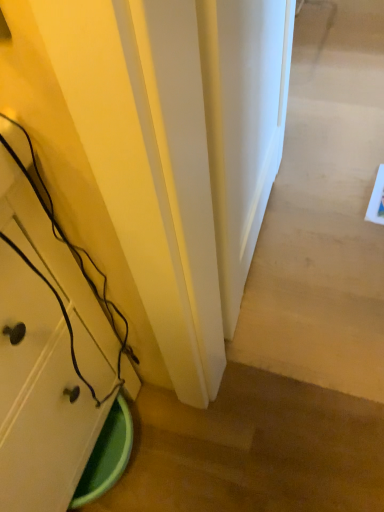
This screenshot has height=512, width=384. What do you see at coordinates (39, 397) in the screenshot?
I see `matte white cabinet at lower left` at bounding box center [39, 397].

This screenshot has height=512, width=384. In order to click on matte white cabinet at lower left in this screenshot , I will do `click(39, 397)`.

In order to face matte white cabinet at lower left, should I rotate leftwards or rightwards?

To align with it, rotate left about 28.756°.

Consider the image. Measure the distance between white smooth door at center and camera.

The depth of white smooth door at center is 51.93 centimeters.

This screenshot has width=384, height=512. Identify the location of white smooth door at center. (243, 124).

This screenshot has width=384, height=512. What do you see at coordinates (243, 124) in the screenshot? I see `white smooth door at center` at bounding box center [243, 124].

Find the location of `matte white cabinet at lower left`. matte white cabinet at lower left is located at coordinates (39, 397).

Is white smooth door at center to the left or to the right of matte white cabinet at lower left in the image?

white smooth door at center is to the right of matte white cabinet at lower left.

Does white smooth door at center lie behind matte white cabinet at lower left?

Yes, the depth of white smooth door at center is greater than that of matte white cabinet at lower left.

Which is closer to the camera, (206, 91) or (53, 281)?

Positioned in front is point (206, 91).

From the image's perspective, is white smooth door at center beneath matte white cabinet at lower left?

No.

From a real-world perspective, between white smooth door at center and matte white cabinet at lower left, who is vertically lower?

matte white cabinet at lower left.

In terms of width, does white smooth door at center look wider or thinner when compared to matte white cabinet at lower left?

white smooth door at center is thinner than matte white cabinet at lower left.

Looking at this image, in terms of height, does white smooth door at center look taller or shorter compared to matte white cabinet at lower left?

Clearly, white smooth door at center is taller compared to matte white cabinet at lower left.

Which of these two, white smooth door at center or matte white cabinet at lower left, is bigger?

With larger size is matte white cabinet at lower left.

Could matte white cabinet at lower left be considered to be inside white smooth door at center?

No, matte white cabinet at lower left is not surrounded by white smooth door at center.

Are white smooth door at center and matte white cabinet at lower left located far from each other?

No, white smooth door at center is not far away from matte white cabinet at lower left.

Based on the photo, is white smooth door at center oriented away from matte white cabinet at lower left?

No, white smooth door at center is not facing away from matte white cabinet at lower left.

How different are the orientations of white smooth door at center and matte white cabinet at lower left in degrees?

white smooth door at center and matte white cabinet at lower left are facing 2.95 degrees away from each other.

At what (x,y) coordinates should I click in order to perform the action: click on cabinetry in front of the white smooth door at center. Please return your answer as a coordinate pair (x, y). This screenshot has height=512, width=384. Looking at the image, I should click on (39, 397).

Can you confirm if matte white cabinet at lower left is positioned to the left of white smooth door at center?

Correct, you'll find matte white cabinet at lower left to the left of white smooth door at center.

Between matte white cabinet at lower left and white smooth door at center, which one is positioned in front?

matte white cabinet at lower left is more forward.

Which is in front, point (91, 362) or point (276, 99)?

Point (91, 362)

From the image's perspective, does matte white cabinet at lower left appear higher than white smooth door at center?

Incorrect, from the image's perspective, matte white cabinet at lower left is lower than white smooth door at center.

From a real-world perspective, which object rests below the other?

matte white cabinet at lower left is physically lower.

Does matte white cabinet at lower left have a greater width compared to white smooth door at center?

Indeed, matte white cabinet at lower left has a greater width compared to white smooth door at center.

Which of these two, matte white cabinet at lower left or white smooth door at center, stands taller?

With more height is white smooth door at center.

Between matte white cabinet at lower left and white smooth door at center, which one has larger size?

Bigger between the two is matte white cabinet at lower left.

Is white smooth door at center a part of matte white cabinet at lower left?

That's incorrect, white smooth door at center is not inside matte white cabinet at lower left.

Are matte white cabinet at lower left and white smooth door at center far apart?

That's not correct — matte white cabinet at lower left is a little close to white smooth door at center.

Is matte white cabinet at lower left looking in the opposite direction of white smooth door at center?

No.

How different are the orientations of matte white cabinet at lower left and white smooth door at center in degrees?

The angular difference between matte white cabinet at lower left and white smooth door at center is 2.95 degrees.

At what (x,y) coordinates should I click in order to perform the action: click on door above the matte white cabinet at lower left (from the image's perspective). Please return your answer as a coordinate pair (x, y). This screenshot has height=512, width=384. Looking at the image, I should click on (243, 124).

Find the location of a particular element. The height and width of the screenshot is (512, 384). door lying above the matte white cabinet at lower left (from the image's perspective) is located at coordinates (243, 124).

Locate an element on the screen. The width and height of the screenshot is (384, 512). door above the matte white cabinet at lower left (from a real-world perspective) is located at coordinates point(243,124).